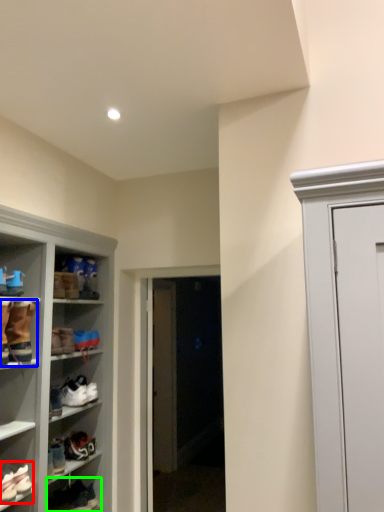
Question: Based on their relative distances, which object is farther from footwear (highlighted by a red box)? Choose from footwear (highlighted by a blue box) and footwear (highlighted by a green box).

Choices:
 (A) footwear
 (B) footwear

Answer: (A)